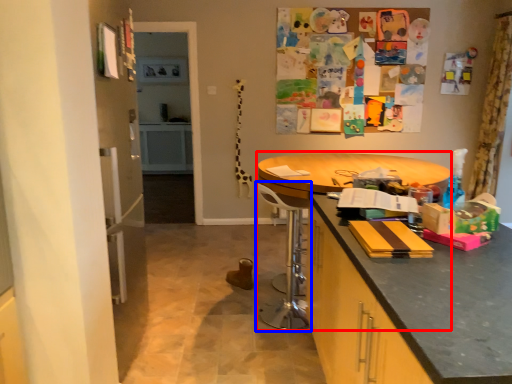
Question: Among these objects, which one is nearest to the camera, round table (highlighted by a red box) or swivel chair (highlighted by a blue box)?

Choices:
 (A) round table
 (B) swivel chair

Answer: (A)